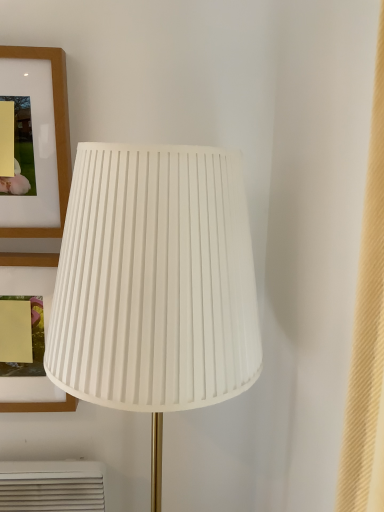
Question: Considering the positions of matte wood picture frame at upper left, arranged as the 2th picture frame when viewed from the top, and matte wood picture frame at upper left, placed as the second picture frame when sorted from bottom to top, in the image, is matte wood picture frame at upper left, arranged as the 2th picture frame when viewed from the top, wider or thinner than matte wood picture frame at upper left, placed as the second picture frame when sorted from bottom to top,?

Choices:
 (A) wide
 (B) thin

Answer: (A)

Question: Based on their sizes in the image, would you say matte wood picture frame at upper left, arranged as the 2th picture frame when viewed from the top, is bigger or smaller than matte wood picture frame at upper left, placed as the second picture frame when sorted from bottom to top?

Choices:
 (A) small
 (B) big

Answer: (B)

Question: Based on their relative distances, which object is nearer to the matte wood picture frame at upper left, arranged as the 2th picture frame when viewed from the top?

Choices:
 (A) white pleated fabric lampshade at center
 (B) matte wood picture frame at upper left, placed as the second picture frame when sorted from bottom to top

Answer: (A)

Question: Which object is positioned farthest from the matte wood picture frame at upper left, placed as the second picture frame when sorted from bottom to top?

Choices:
 (A) matte wood picture frame at upper left, positioned as the 1th picture frame in bottom-to-top order
 (B) white pleated fabric lampshade at center

Answer: (A)